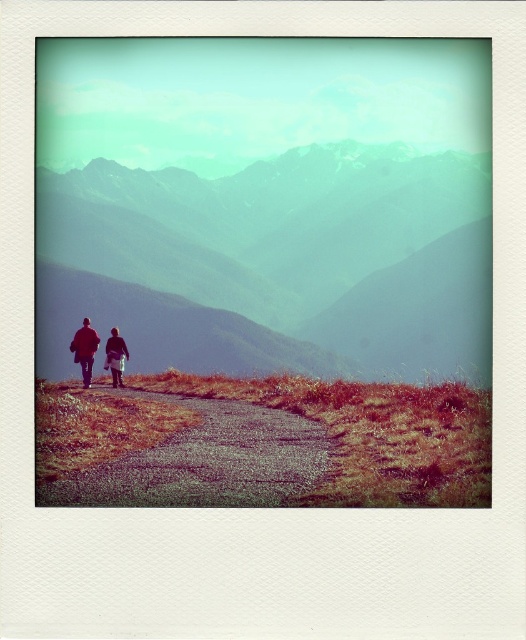
You are standing at the starting point of the path and want to take a photo of the green textured mountains at upper center. If your camera can focus up to 600 feet, will you be able to capture the mountains clearly?

The green textured mountains at upper center and camera are 621.78 feet apart from each other. Since the camera can only focus up to 600 feet, it will not be able to capture the mountains clearly.

You are a photographer trying to capture a photo of both the brown leather jacket at lower left and the red woolen jacket at left. Since you want to include both in the frame, which jacket should you focus on to ensure both are visible?

The brown leather jacket at lower left is narrower than the red woolen jacket at left, so focusing on the red woolen jacket at left would allow the smaller brown leather jacket at lower left to fit into the frame as well.

From the picture: You are standing at the point with coordinates point (105, 360) and want to walk towards the distant mountains. There is a point (214, 296) behind you. Which direction should you walk to reach the mountains?

You should walk forward towards the distant mountains. The point (214, 296) is behind you, so moving away from it will lead you toward the mountains.